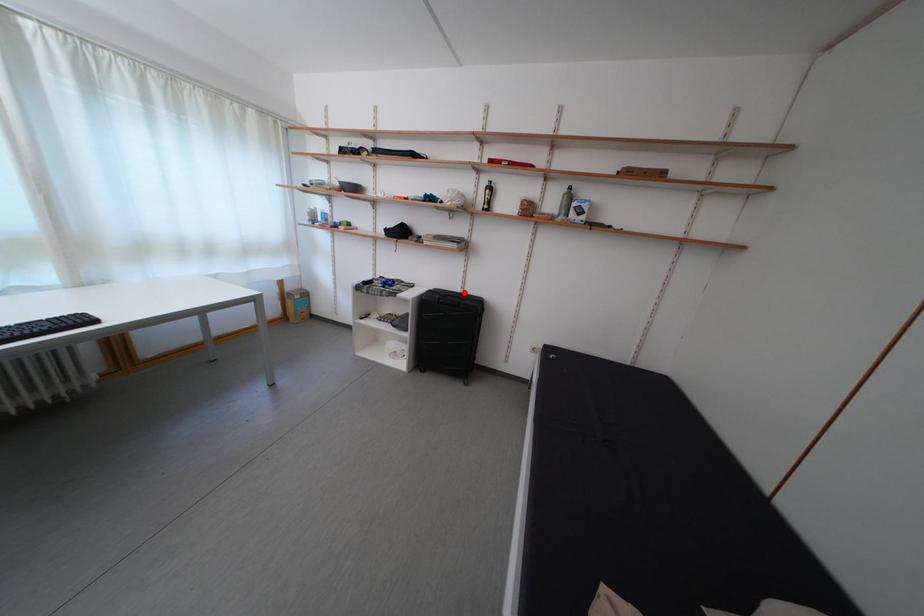
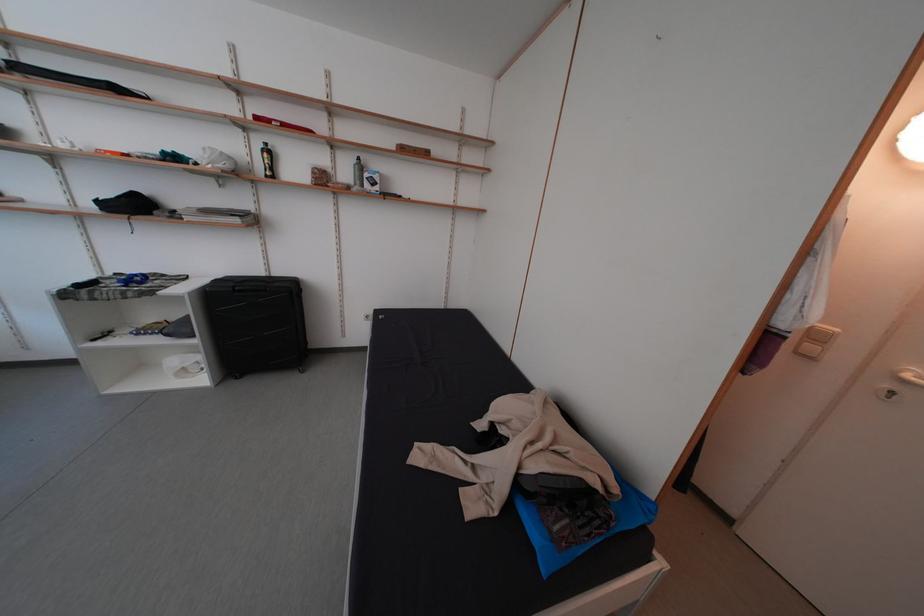
Question: A red point is marked in image1. In image2, is the corresponding 3D point closer to the camera or farther? Reply with the corresponding letter.

Choices:
 (A) The corresponding 3D point is closer.
 (B) The corresponding 3D point is farther.

Answer: (A)